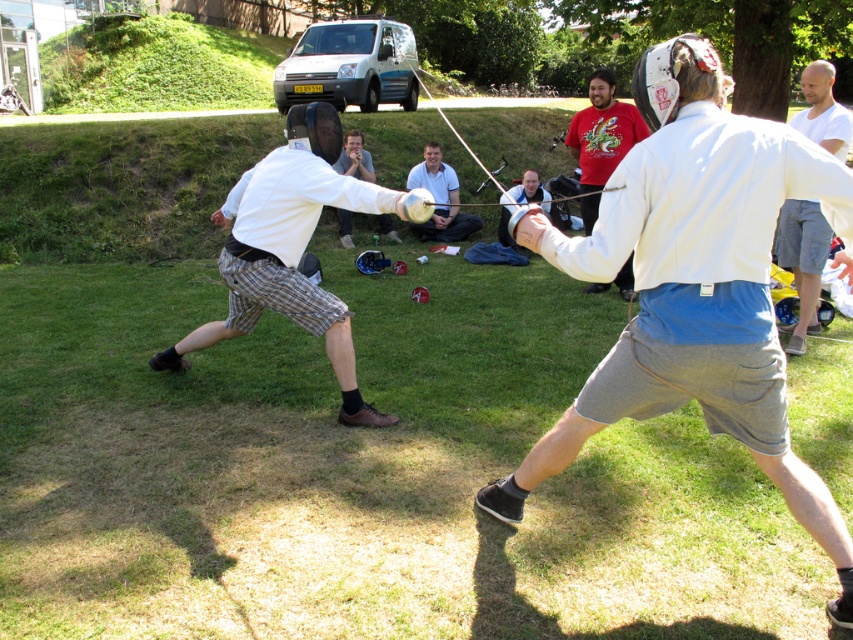
From the picture: Is white cotton shirt at upper right below red dragon shirt at center?

Yes.

Which is below, white cotton shirt at upper right or red dragon shirt at center?

white cotton shirt at upper right is lower down.

Is point (788, 243) behind point (584, 204)?

No, (788, 243) is in front of (584, 204).

Where is `white cotton shirt at upper right`? white cotton shirt at upper right is located at coordinates (802, 260).

Is red dragon shirt at center bigger than matte silver helmet at center?

Indeed, red dragon shirt at center has a larger size compared to matte silver helmet at center.

Which is more to the left, red dragon shirt at center or matte silver helmet at center?

From the viewer's perspective, matte silver helmet at center appears more on the left side.

This screenshot has height=640, width=853. In order to click on red dragon shirt at center in this screenshot , I will do `click(602, 131)`.

The height and width of the screenshot is (640, 853). Identify the location of red dragon shirt at center. (602, 131).

Is white matte fencing mask at center closer to the viewer compared to red dragon shirt at center?

No, white matte fencing mask at center is further to the viewer.

Can you confirm if white matte fencing mask at center is smaller than red dragon shirt at center?

Yes.

Does point (260, 250) come farther from viewer compared to point (596, 170)?

No, it is not.

At what (x,y) coordinates should I click in order to perform the action: click on white matte fencing mask at center. Please return your answer as a coordinate pair (x, y). Looking at the image, I should click on (292, 252).